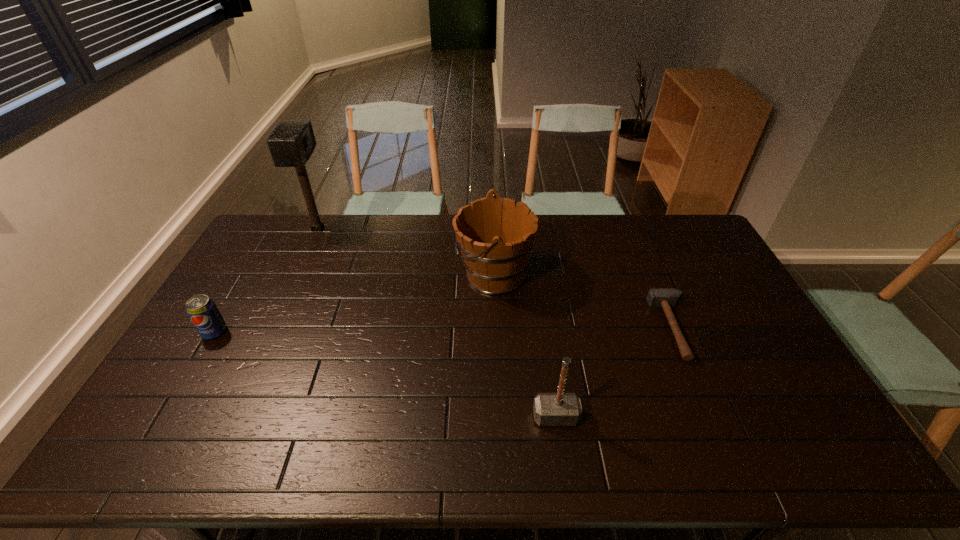
Image resolution: width=960 pixels, height=540 pixels. I want to click on vacant position located with the handle on the wine bucket, so click(x=415, y=275).

In order to click on free space located with the handle on the wine bucket in this screenshot , I will do tap(350, 275).

Locate an element on the screen. free location located with the handle on the wine bucket is located at coordinates (359, 275).

In order to click on free region located 0.070m on the striking surface of the nearer hammer in this screenshot , I will do pyautogui.click(x=562, y=455).

At what (x,y) coordinates should I click in order to perform the action: click on free spot located 0.130m on the front of the leftmost object. Please return your answer as a coordinate pair (x, y). Image resolution: width=960 pixels, height=540 pixels. Looking at the image, I should click on (187, 378).

Where is `free space located 0.070m on the striking surface of the rightmost object`? Image resolution: width=960 pixels, height=540 pixels. free space located 0.070m on the striking surface of the rightmost object is located at coordinates (x=634, y=328).

The image size is (960, 540). I want to click on free region located 0.250m on the striking surface of the rightmost object, so click(x=574, y=328).

Where is `vacant space located 0.340m on the striking surface of the rightmost object`? Image resolution: width=960 pixels, height=540 pixels. vacant space located 0.340m on the striking surface of the rightmost object is located at coordinates (544, 328).

Where is `mallet at the far edge`? The height and width of the screenshot is (540, 960). mallet at the far edge is located at coordinates (292, 142).

You are a GUI agent. You are given a task and a screenshot of the screen. Output one action in this format:
    pyautogui.click(x=<x>, y=<y>)
    Task: Click on the wine bucket at the far edge
    
    Given the screenshot: What is the action you would take?
    tap(495, 235)